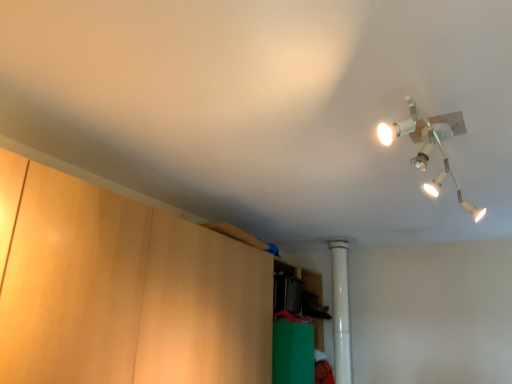
How much space does green matte cabinet at lower center, which is the 1th cabinetry from back to front, occupy vertically?

The height of green matte cabinet at lower center, which is the 1th cabinetry from back to front, is 36.87 centimeters.

Measure the distance between white metallic lamp at upper right and camera.

The distance of white metallic lamp at upper right from camera is 38.13 inches.

Find the location of a particular element. The image size is (512, 384). white plastic pipe at center is located at coordinates (340, 311).

In terms of width, does white plastic pipe at center look wider or thinner when compared to green matte cabinet at lower center, which is the 1th cabinetry from back to front?

white plastic pipe at center is thinner than green matte cabinet at lower center, which is the 1th cabinetry from back to front.

Between white plastic pipe at center and green matte cabinet at lower center, which ranks as the 2th cabinetry in front-to-back order, which one has less height?

green matte cabinet at lower center, which ranks as the 2th cabinetry in front-to-back order.

From a real-world perspective, is white plastic pipe at center located higher than green matte cabinet at lower center, which is the 1th cabinetry from back to front?

Yes, from a real-world perspective, white plastic pipe at center is above green matte cabinet at lower center, which is the 1th cabinetry from back to front.

At what (x,y) coordinates should I click in order to perform the action: click on pipe that appears above the green matte cabinet at lower center, which is the 1th cabinetry from back to front (from a real-world perspective). Please return your answer as a coordinate pair (x, y). Looking at the image, I should click on (340, 311).

What's the angular difference between green matte cabinet at lower center, which ranks as the 2th cabinetry in front-to-back order, and wooden cabinet at left, the 1th cabinetry viewed from the front,'s facing directions?

The angular difference between green matte cabinet at lower center, which ranks as the 2th cabinetry in front-to-back order, and wooden cabinet at left, the 1th cabinetry viewed from the front, is 0.209 degrees.

Considering the positions of points (296, 376) and (153, 314), is point (296, 376) farther from camera compared to point (153, 314)?

That is True.

Consider the image. Is green matte cabinet at lower center, which ranks as the 2th cabinetry in front-to-back order, directly adjacent to wooden cabinet at left, the 1th cabinetry viewed from the front?

There is a gap between green matte cabinet at lower center, which ranks as the 2th cabinetry in front-to-back order, and wooden cabinet at left, the 1th cabinetry viewed from the front.

Considering the relative positions of white plastic pipe at center and wooden cabinet at left, which ranks as the 2th cabinetry in back-to-front order, in the image provided, is white plastic pipe at center behind wooden cabinet at left, which ranks as the 2th cabinetry in back-to-front order,?

Yes, white plastic pipe at center is further from the camera.

Is point (343, 258) positioned in front of point (81, 343)?

No, it is behind (81, 343).

Measure the distance from white plastic pipe at center to wooden cabinet at left, which ranks as the 2th cabinetry in back-to-front order.

The distance of white plastic pipe at center from wooden cabinet at left, which ranks as the 2th cabinetry in back-to-front order, is 1.54 meters.

Is white plastic pipe at center looking in the opposite direction of wooden cabinet at left, the 1th cabinetry viewed from the front?

That's right, white plastic pipe at center is facing away from wooden cabinet at left, the 1th cabinetry viewed from the front.

Considering the positions of objects green matte cabinet at lower center, which ranks as the 2th cabinetry in front-to-back order, and white metallic lamp at upper right in the image provided, who is in front, green matte cabinet at lower center, which ranks as the 2th cabinetry in front-to-back order, or white metallic lamp at upper right?

white metallic lamp at upper right is more forward.

Is point (308, 366) closer or farther from the camera than point (426, 129)?

Point (308, 366) is farther from the camera than point (426, 129).

Is green matte cabinet at lower center, which is the 1th cabinetry from back to front, turned away from white metallic lamp at upper right?

No.

Which object is closer to the camera, wooden cabinet at left, which ranks as the 2th cabinetry in back-to-front order, or green matte cabinet at lower center, which is the 1th cabinetry from back to front?

wooden cabinet at left, which ranks as the 2th cabinetry in back-to-front order, is in front.

Between wooden cabinet at left, the 1th cabinetry viewed from the front, and green matte cabinet at lower center, which ranks as the 2th cabinetry in front-to-back order, which one appears on the right side from the viewer's perspective?

green matte cabinet at lower center, which ranks as the 2th cabinetry in front-to-back order.

Looking at the image, does wooden cabinet at left, which ranks as the 2th cabinetry in back-to-front order, seem bigger or smaller compared to green matte cabinet at lower center, which ranks as the 2th cabinetry in front-to-back order?

In the image, wooden cabinet at left, which ranks as the 2th cabinetry in back-to-front order, appears to be larger than green matte cabinet at lower center, which ranks as the 2th cabinetry in front-to-back order.

Does point (30, 358) come farther from viewer compared to point (341, 273)?

No.

Consider the image. From a real-world perspective, is wooden cabinet at left, the 1th cabinetry viewed from the front, beneath white plastic pipe at center?

Yes, from a real-world perspective, wooden cabinet at left, the 1th cabinetry viewed from the front, is beneath white plastic pipe at center.

Would you say white metallic lamp at upper right is inside or outside green matte cabinet at lower center, which ranks as the 2th cabinetry in front-to-back order?

white metallic lamp at upper right is spatially situated outside green matte cabinet at lower center, which ranks as the 2th cabinetry in front-to-back order.

From a real-world perspective, is white metallic lamp at upper right physically below green matte cabinet at lower center, which ranks as the 2th cabinetry in front-to-back order?

Incorrect, from a real-world perspective, white metallic lamp at upper right is higher than green matte cabinet at lower center, which ranks as the 2th cabinetry in front-to-back order.

I want to click on cabinetry that is the 1st one when counting leftward from the white metallic lamp at upper right, so click(x=292, y=353).

Which is in front, point (429, 129) or point (311, 371)?

The point (429, 129) is more forward.

What are the coordinates of `pipe lying on the right of green matte cabinet at lower center, which is the 1th cabinetry from back to front` in the screenshot? It's located at (340, 311).

Locate an element on the screen. The width and height of the screenshot is (512, 384). cabinetry on the left side of green matte cabinet at lower center, which is the 1th cabinetry from back to front is located at coordinates (127, 293).

When comparing their distances from green matte cabinet at lower center, which ranks as the 2th cabinetry in front-to-back order, does wooden cabinet at left, the 1th cabinetry viewed from the front, or white plastic pipe at center seem closer?

Among the two, white plastic pipe at center is located nearer to green matte cabinet at lower center, which ranks as the 2th cabinetry in front-to-back order.

Looking at the image, which one is located closer to white plastic pipe at center, green matte cabinet at lower center, which is the 1th cabinetry from back to front, or wooden cabinet at left, which ranks as the 2th cabinetry in back-to-front order?

green matte cabinet at lower center, which is the 1th cabinetry from back to front.

Considering their positions, is green matte cabinet at lower center, which is the 1th cabinetry from back to front, positioned closer to wooden cabinet at left, which ranks as the 2th cabinetry in back-to-front order, than white plastic pipe at center?

Based on the image, green matte cabinet at lower center, which is the 1th cabinetry from back to front, appears to be nearer to wooden cabinet at left, which ranks as the 2th cabinetry in back-to-front order.

From the picture: From the image, which object appears to be nearer to white metallic lamp at upper right, wooden cabinet at left, the 1th cabinetry viewed from the front, or white plastic pipe at center?

Based on the image, wooden cabinet at left, the 1th cabinetry viewed from the front, appears to be nearer to white metallic lamp at upper right.

Which object lies nearer to the anchor point green matte cabinet at lower center, which is the 1th cabinetry from back to front, wooden cabinet at left, the 1th cabinetry viewed from the front, or white metallic lamp at upper right?

wooden cabinet at left, the 1th cabinetry viewed from the front.

Considering their positions, is wooden cabinet at left, the 1th cabinetry viewed from the front, positioned further to white metallic lamp at upper right than green matte cabinet at lower center, which ranks as the 2th cabinetry in front-to-back order?

Based on the image, green matte cabinet at lower center, which ranks as the 2th cabinetry in front-to-back order, appears to be further to white metallic lamp at upper right.

Looking at the image, which one is located further to white metallic lamp at upper right, green matte cabinet at lower center, which is the 1th cabinetry from back to front, or wooden cabinet at left, which ranks as the 2th cabinetry in back-to-front order?

green matte cabinet at lower center, which is the 1th cabinetry from back to front.

From the image, which object appears to be farther from white metallic lamp at upper right, white plastic pipe at center or wooden cabinet at left, the 1th cabinetry viewed from the front?

white plastic pipe at center is further to white metallic lamp at upper right.

The width and height of the screenshot is (512, 384). I want to click on cabinetry between wooden cabinet at left, which ranks as the 2th cabinetry in back-to-front order, and white plastic pipe at center, along the z-axis, so click(292, 353).

Identify the location of lamp located between wooden cabinet at left, the 1th cabinetry viewed from the front, and white plastic pipe at center in the depth direction. The width and height of the screenshot is (512, 384). (430, 146).

The height and width of the screenshot is (384, 512). Identify the location of cabinetry located between white metallic lamp at upper right and white plastic pipe at center in the depth direction. (292, 353).

Locate an element on the screen. Image resolution: width=512 pixels, height=384 pixels. lamp between wooden cabinet at left, which ranks as the 2th cabinetry in back-to-front order, and green matte cabinet at lower center, which ranks as the 2th cabinetry in front-to-back order, from front to back is located at coordinates (430, 146).